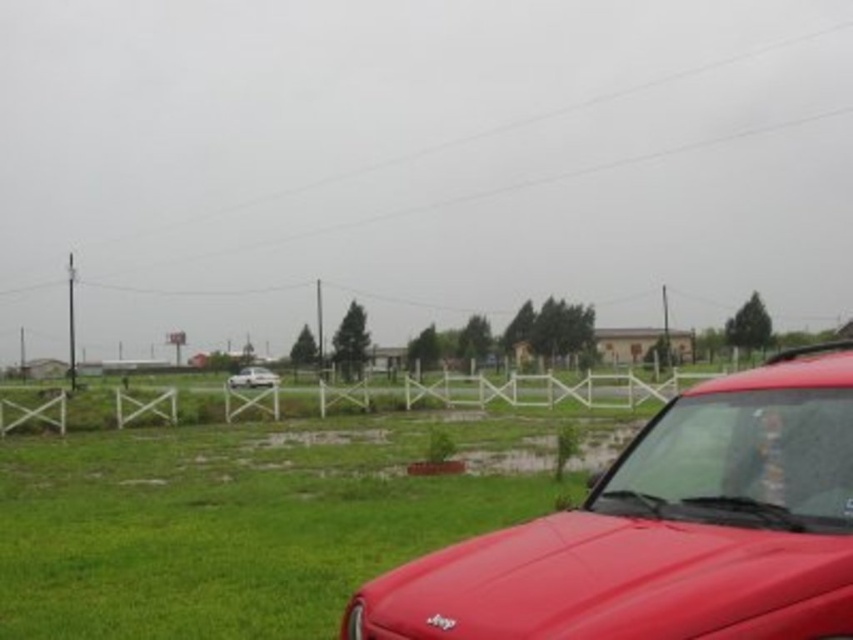
Who is higher up, shiny red car at lower right or white matte sedan at center?

Positioned higher is shiny red car at lower right.

Which is below, shiny red car at lower right or white matte sedan at center?

Positioned lower is white matte sedan at center.

The width and height of the screenshot is (853, 640). I want to click on shiny red car at lower right, so click(666, 531).